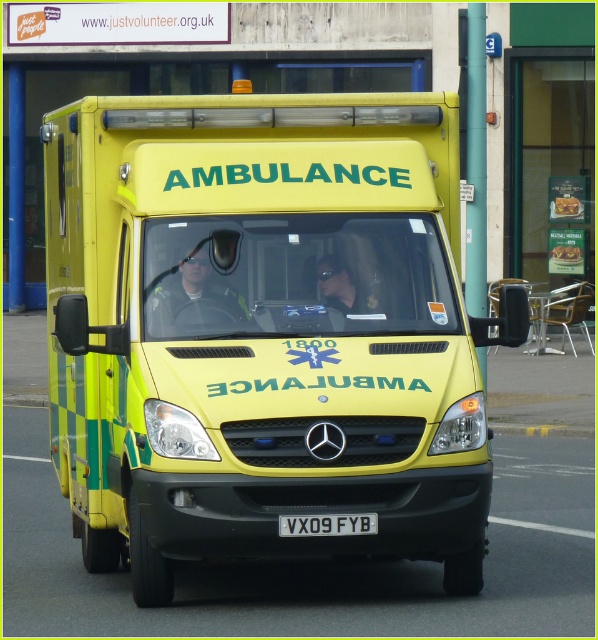
Question: Among these points, which one is farthest from the camera?

Choices:
 (A) (327, 284)
 (B) (371, 522)
 (C) (182, 262)

Answer: (A)

Question: Can you confirm if yellow matte ambulance at center is positioned below reflective safety vest at center?

Choices:
 (A) no
 (B) yes

Answer: (A)

Question: Which point appears closest to the camera in this image?

Choices:
 (A) (197, 272)
 (B) (370, 314)

Answer: (B)

Question: Is yellow matte ambulance at center to the right of white plastic license plate at center from the viewer's perspective?

Choices:
 (A) no
 (B) yes

Answer: (A)

Question: From the image, what is the correct spatial relationship of yellow matte ambulance at center in relation to reflective safety vest at center?

Choices:
 (A) right
 (B) left

Answer: (A)

Question: Among these objects, which one is farthest from the camera?

Choices:
 (A) reflective safety vest at center
 (B) matte black uniform at center
 (C) yellow matte ambulance at center
 (D) white plastic license plate at center

Answer: (B)